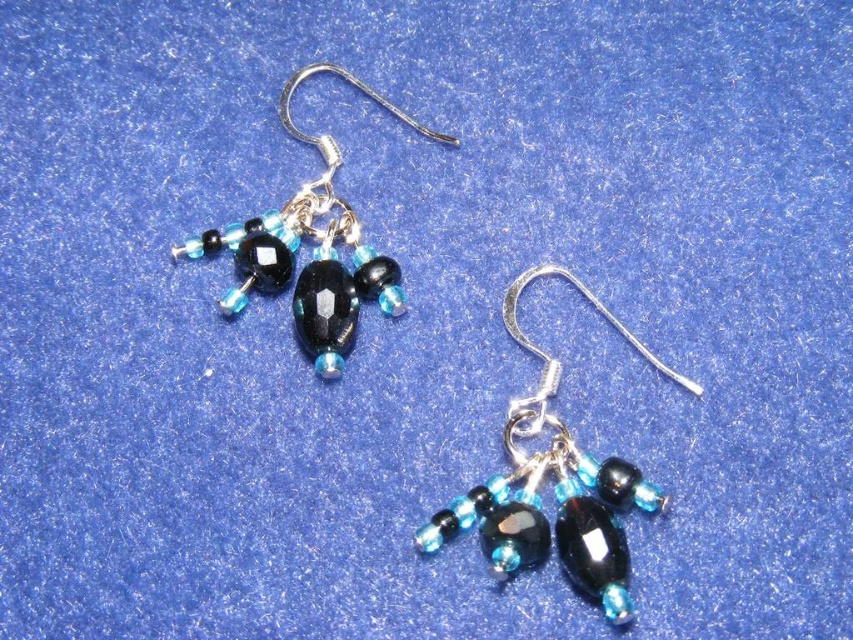
Between matte black glass bead at center and matte black bead at upper left, which one appears on the right side from the viewer's perspective?

matte black glass bead at center

Does matte black glass bead at center come behind matte black bead at upper left?

No.

In order to click on matte black glass bead at center in this screenshot , I will do `click(554, 484)`.

Find the location of a particular element. The image size is (853, 640). matte black glass bead at center is located at coordinates (554, 484).